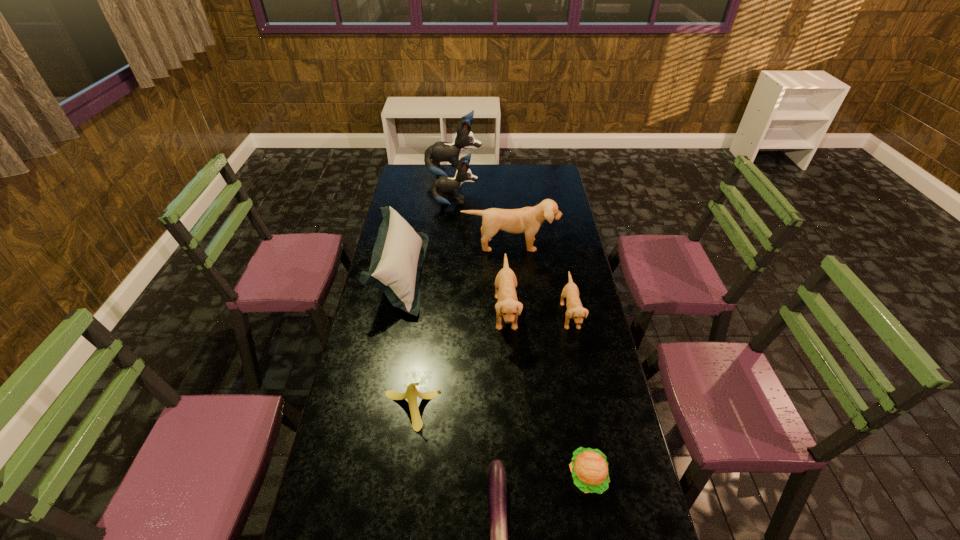
In the image, there is a desktop. What are the coordinates of `vacant space at the left edge` in the screenshot? It's located at (350, 364).

Image resolution: width=960 pixels, height=540 pixels. What are the coordinates of `free space at the right edge` in the screenshot? It's located at (615, 399).

Image resolution: width=960 pixels, height=540 pixels. In order to click on free space between the cushion and the farther black puppy in this screenshot , I will do `click(427, 225)`.

Where is `free space between the second biggest beige puppy and the bigger black puppy`? Image resolution: width=960 pixels, height=540 pixels. free space between the second biggest beige puppy and the bigger black puppy is located at coordinates (480, 244).

Locate an element on the screen. Image resolution: width=960 pixels, height=540 pixels. free space between the cushion and the fourth tallest puppy is located at coordinates pyautogui.click(x=453, y=293).

Find the location of a particular element. unoccupied area between the smallest beige puppy and the second biggest beige puppy is located at coordinates (538, 314).

Locate an element on the screen. free area in between the third nearest object and the smaller black puppy is located at coordinates (433, 307).

The height and width of the screenshot is (540, 960). What are the coordinates of `object that is the fifth closest to the fourth nearest puppy` in the screenshot? It's located at (575, 310).

This screenshot has height=540, width=960. What are the coordinates of `the seventh closest object to the second shortest puppy` in the screenshot? It's located at (444, 184).

Point out which puppy is positioned as the fourth nearest to the second smallest beige puppy. Please provide its 2D coordinates. Your answer should be formatted as a tuple, i.e. [(x, y)], where the tuple contains the x and y coordinates of a point satisfying the conditions above.

[(440, 151)]